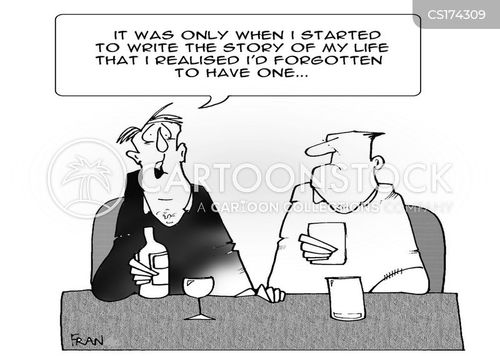
The image size is (500, 356). I want to click on wine glass, so click(x=206, y=291).